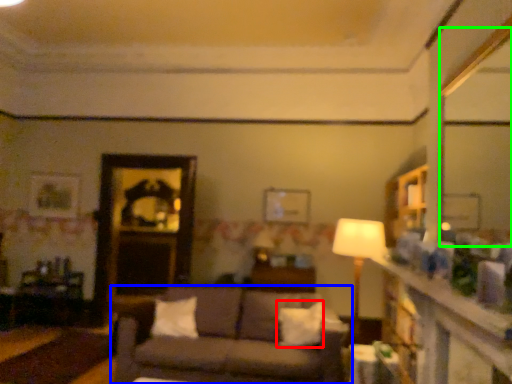
Question: Estimate the real-world distances between objects in this image. Which object is closer to pillow (highlighted by a red box), studio couch (highlighted by a blue box) or mirror (highlighted by a green box)?

Choices:
 (A) studio couch
 (B) mirror

Answer: (A)